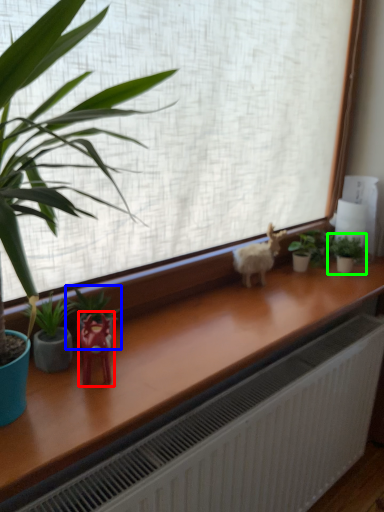
Question: Estimate the real-world distances between objects in this image. Which object is farther from miniature (highlighted by a red box), houseplant (highlighted by a blue box) or houseplant (highlighted by a green box)?

Choices:
 (A) houseplant
 (B) houseplant

Answer: (B)